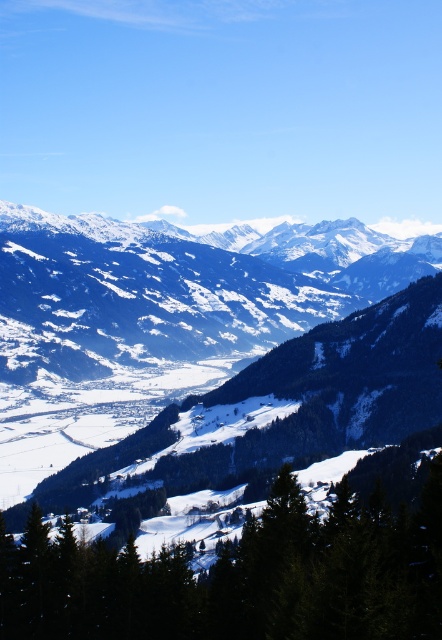
Who is positioned more to the right, snowy rocky mountain range at center or green textured tree at center?

Positioned to the right is green textured tree at center.

Is snowy rocky mountain range at center thinner than green textured tree at center?

No.

Is point (357, 264) positioned before point (71, 612)?

That is False.

Image resolution: width=442 pixels, height=640 pixels. In order to click on snowy rocky mountain range at center in this screenshot , I will do `click(179, 289)`.